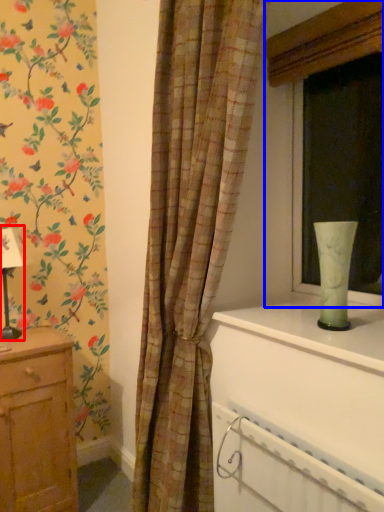
Question: Which object is closer to the camera taking this photo, table lamp (highlighted by a red box) or window (highlighted by a blue box)?

Choices:
 (A) table lamp
 (B) window

Answer: (B)